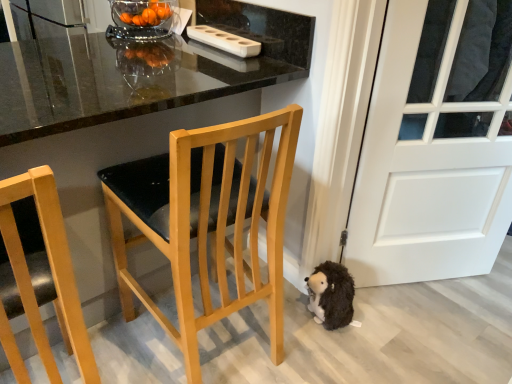
Question: Is white matte door at lower right facing towards transparent glass bowl at upper center?

Choices:
 (A) yes
 (B) no

Answer: (B)

Question: From a real-world perspective, is white matte door at lower right over transparent glass bowl at upper center?

Choices:
 (A) yes
 (B) no

Answer: (B)

Question: Is white matte door at lower right facing away from transparent glass bowl at upper center?

Choices:
 (A) yes
 (B) no

Answer: (B)

Question: Considering the relative sizes of white matte door at lower right and transparent glass bowl at upper center in the image provided, is white matte door at lower right wider than transparent glass bowl at upper center?

Choices:
 (A) yes
 (B) no

Answer: (B)

Question: From the image's perspective, is white matte door at lower right under transparent glass bowl at upper center?

Choices:
 (A) no
 (B) yes

Answer: (B)

Question: Is point (141, 19) positioned closer to the camera than point (193, 31)?

Choices:
 (A) closer
 (B) farther

Answer: (A)

Question: Looking at their shapes, would you say transparent glass bowl at upper center is wider or thinner than white plastic container at upper center?

Choices:
 (A) thin
 (B) wide

Answer: (B)

Question: Considering the positions of transparent glass bowl at upper center and white plastic container at upper center in the image, is transparent glass bowl at upper center bigger or smaller than white plastic container at upper center?

Choices:
 (A) small
 (B) big

Answer: (B)

Question: In the image, is transparent glass bowl at upper center on the left side or the right side of white plastic container at upper center?

Choices:
 (A) right
 (B) left

Answer: (B)

Question: From a real-world perspective, is white plastic container at upper center physically located above or below transparent glass bowl at upper center?

Choices:
 (A) below
 (B) above

Answer: (A)

Question: In terms of size, does white plastic container at upper center appear bigger or smaller than transparent glass bowl at upper center?

Choices:
 (A) small
 (B) big

Answer: (A)

Question: In the image, is white plastic container at upper center positioned in front of or behind transparent glass bowl at upper center?

Choices:
 (A) front
 (B) behind

Answer: (A)

Question: From the image's perspective, is white plastic container at upper center above or below transparent glass bowl at upper center?

Choices:
 (A) below
 (B) above

Answer: (A)

Question: From the image's perspective, relative to transparent glass bowl at upper center, is light wood chair at center, placed as the second chair when sorted from left to right, above or below?

Choices:
 (A) below
 (B) above

Answer: (A)

Question: From a real-world perspective, is light wood chair at center, the first chair in the right-to-left sequence, physically located above or below transparent glass bowl at upper center?

Choices:
 (A) above
 (B) below

Answer: (B)